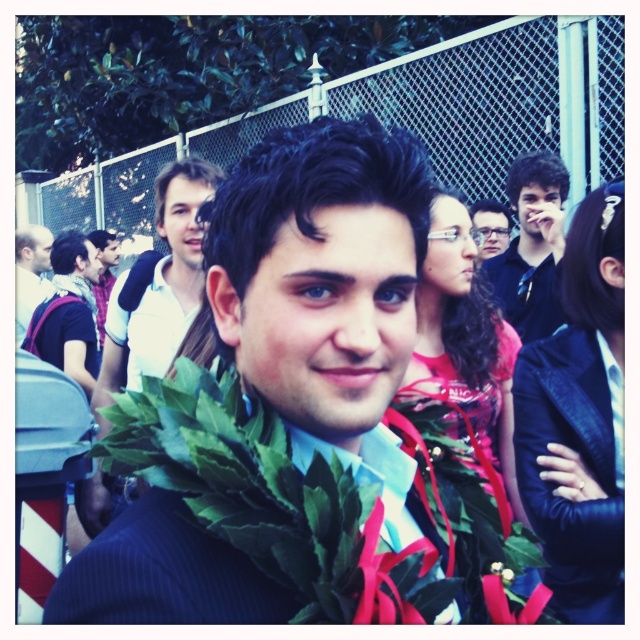
Is matte black glasses at upper center to the left of matte white shirt at center from the viewer's perspective?

Incorrect, matte black glasses at upper center is not on the left side of matte white shirt at center.

Does matte black glasses at upper center have a smaller size compared to matte white shirt at center?

→ Yes.

In order to click on matte black glasses at upper center in this screenshot , I will do `click(490, 227)`.

Can you confirm if white shirt at upper left is thinner than matte white shirt at center?

Yes, white shirt at upper left is thinner than matte white shirt at center.

Does white shirt at upper left lie in front of matte white shirt at center?

Yes, white shirt at upper left is closer to the viewer.

Does point (195, 161) come behind point (113, 256)?

No, (195, 161) is closer to viewer.

The image size is (640, 640). I want to click on white shirt at upper left, so click(157, 285).

What do you see at coordinates (531, 246) in the screenshot?
I see `dark blue shirt at upper right` at bounding box center [531, 246].

Is dark blue shirt at upper right wider than matte black glasses at upper center?

Yes.

Is point (529, 237) less distant than point (472, 208)?

Yes, it is in front of point (472, 208).

Find the location of a particular element. dark blue shirt at upper right is located at coordinates (531, 246).